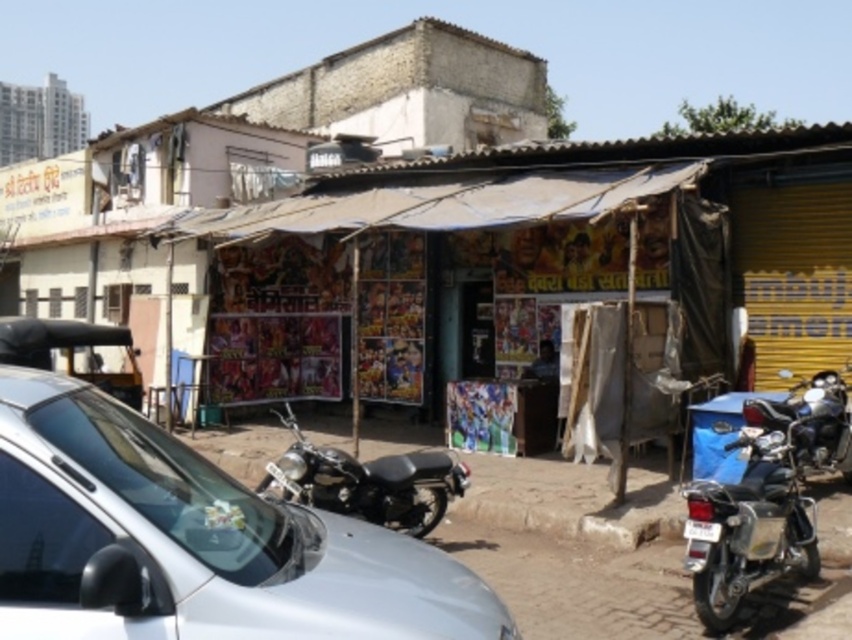
Can you confirm if shiny metallic motorcycle at lower right is smaller than shiny chrome motorcycle at right?

Indeed, shiny metallic motorcycle at lower right has a smaller size compared to shiny chrome motorcycle at right.

Who is lower down, shiny metallic motorcycle at lower right or shiny chrome motorcycle at right?

shiny metallic motorcycle at lower right

What do you see at coordinates (750, 525) in the screenshot? I see `shiny metallic motorcycle at lower right` at bounding box center [750, 525].

I want to click on shiny metallic motorcycle at lower right, so click(750, 525).

Who is shorter, shiny black motorcycle at center or shiny chrome motorcycle at right?

shiny black motorcycle at center

Can you confirm if shiny black motorcycle at center is positioned to the left of shiny chrome motorcycle at right?

Correct, you'll find shiny black motorcycle at center to the left of shiny chrome motorcycle at right.

The width and height of the screenshot is (852, 640). Find the location of `shiny black motorcycle at center`. shiny black motorcycle at center is located at coordinates (367, 481).

Where is `shiny black motorcycle at center`? shiny black motorcycle at center is located at coordinates pyautogui.click(x=367, y=481).

Can you confirm if shiny metallic motorcycle at lower right is shorter than white plastic license plate at center?

In fact, shiny metallic motorcycle at lower right may be taller than white plastic license plate at center.

Is shiny metallic motorcycle at lower right to the right of white plastic license plate at center from the viewer's perspective?

Indeed, shiny metallic motorcycle at lower right is positioned on the right side of white plastic license plate at center.

Which is in front, point (789, 554) or point (711, 522)?

Point (711, 522) is in front.

Find the location of `shiny metallic motorcycle at lower right`. shiny metallic motorcycle at lower right is located at coordinates (750, 525).